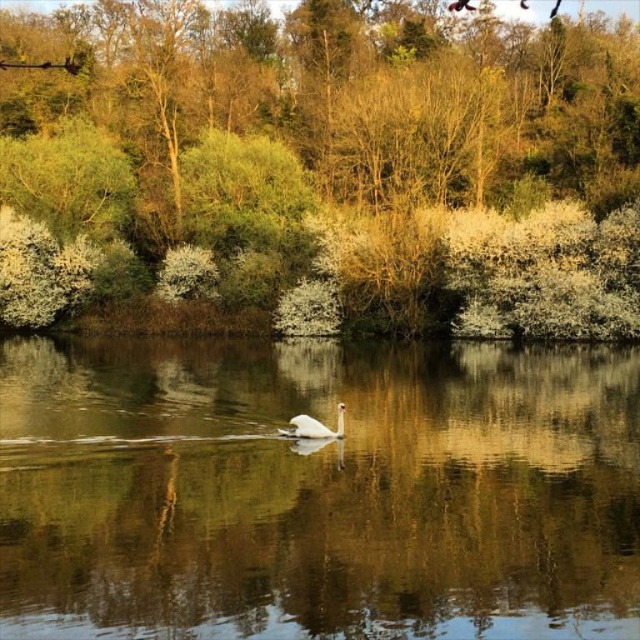
Is clear water at center to the left of white glossy swan at center from the viewer's perspective?

Incorrect, clear water at center is not on the left side of white glossy swan at center.

Between point (264, 586) and point (339, 420), which one is positioned in front?

Point (264, 586) is more forward.

Identify the location of clear water at center. (316, 490).

Who is higher up, green leafy tree at center or white glossy swan at center?

green leafy tree at center is above.

This screenshot has height=640, width=640. What do you see at coordinates (340, 157) in the screenshot?
I see `green leafy tree at center` at bounding box center [340, 157].

Locate an element on the screen. green leafy tree at center is located at coordinates (340, 157).

Can you confirm if clear water at center is positioned above green leafy tree at center?

No.

Is point (378, 364) closer to viewer compared to point (129, 93)?

Yes, point (378, 364) is in front of point (129, 93).

This screenshot has height=640, width=640. I want to click on clear water at center, so click(x=316, y=490).